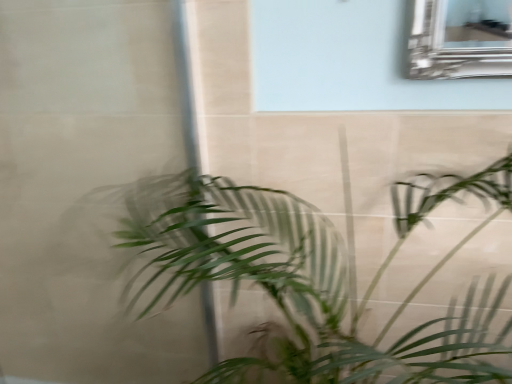
The image size is (512, 384). Identify the location of green leafy plant at center. (309, 279).

The width and height of the screenshot is (512, 384). What do you see at coordinates (309, 279) in the screenshot?
I see `green leafy plant at center` at bounding box center [309, 279].

The image size is (512, 384). What do you see at coordinates (86, 187) in the screenshot?
I see `transparent glass door at left` at bounding box center [86, 187].

Locate an element on the screen. The height and width of the screenshot is (384, 512). transparent glass door at left is located at coordinates (86, 187).

The height and width of the screenshot is (384, 512). What are the coordinates of `green leafy plant at center` in the screenshot? It's located at (309, 279).

Can you confirm if green leafy plant at center is positioned to the right of transparent glass door at left?

Indeed, green leafy plant at center is positioned on the right side of transparent glass door at left.

Relative to transparent glass door at left, is green leafy plant at center in front or behind?

Clearly, green leafy plant at center is in front of transparent glass door at left.

Is point (329, 353) positioned after point (104, 43)?

Yes, point (329, 353) is behind point (104, 43).

From the image's perspective, between green leafy plant at center and transparent glass door at left, who is located below?

green leafy plant at center.

From a real-world perspective, who is located lower, green leafy plant at center or transparent glass door at left?

green leafy plant at center, from a real-world perspective.

Does green leafy plant at center have a greater width compared to transparent glass door at left?

Yes, green leafy plant at center is wider than transparent glass door at left.

Considering the sizes of objects green leafy plant at center and transparent glass door at left in the image provided, who is taller, green leafy plant at center or transparent glass door at left?

Standing taller between the two is transparent glass door at left.

In the scene shown: Who is bigger, green leafy plant at center or transparent glass door at left?

A: green leafy plant at center is bigger.

Is transparent glass door at left surrounded by green leafy plant at center?

Yes, green leafy plant at center is surrounding transparent glass door at left.

Is the surface of green leafy plant at center in direct contact with transparent glass door at left?

No, green leafy plant at center is not next to transparent glass door at left.

Is green leafy plant at center oriented away from transparent glass door at left?

green leafy plant at center is not turned away from transparent glass door at left.

Can you tell me how much green leafy plant at center and transparent glass door at left differ in facing direction?

There is a 90-degree angle between the facing directions of green leafy plant at center and transparent glass door at left.

How distant is green leafy plant at center from transparent glass door at left?

green leafy plant at center is 43.87 centimeters from transparent glass door at left.

Locate an element on the screen. glass door behind the green leafy plant at center is located at coordinates (86, 187).

Visually, is transparent glass door at left positioned to the left or to the right of green leafy plant at center?

transparent glass door at left is positioned on green leafy plant at center's left side.

Which object is more forward, transparent glass door at left or green leafy plant at center?

green leafy plant at center is closer to the camera.

Does point (182, 344) come in front of point (204, 186)?

No, (182, 344) is behind (204, 186).

From the image's perspective, would you say transparent glass door at left is positioned over green leafy plant at center?

Yes, from the image's perspective, transparent glass door at left is on top of green leafy plant at center.

From a real-world perspective, which object rests below the other?

green leafy plant at center is physically lower.

Considering the relative sizes of transparent glass door at left and green leafy plant at center in the image provided, is transparent glass door at left thinner than green leafy plant at center?

Indeed, transparent glass door at left has a lesser width compared to green leafy plant at center.

Between transparent glass door at left and green leafy plant at center, which one has less height?

With less height is green leafy plant at center.

Does transparent glass door at left have a larger size compared to green leafy plant at center?

Actually, transparent glass door at left might be smaller than green leafy plant at center.

Is transparent glass door at left positioned beyond the bounds of green leafy plant at center?

Answer: No, transparent glass door at left is not entirely external to green leafy plant at center.

Is transparent glass door at left directly adjacent to green leafy plant at center?

transparent glass door at left and green leafy plant at center are clearly separated.

Does transparent glass door at left turn towards green leafy plant at center?

Yes, transparent glass door at left is facing green leafy plant at center.

How many degrees apart are the facing directions of transparent glass door at left and green leafy plant at center?

They differ by 90 degrees in their facing directions.

Locate an element on the screen. This screenshot has height=384, width=512. houseplant in front of the transparent glass door at left is located at coordinates (309, 279).

The width and height of the screenshot is (512, 384). In order to click on glass door to the left of green leafy plant at center in this screenshot , I will do `click(86, 187)`.

In order to click on houseplant beneath the transparent glass door at left (from a real-world perspective) in this screenshot , I will do `click(309, 279)`.